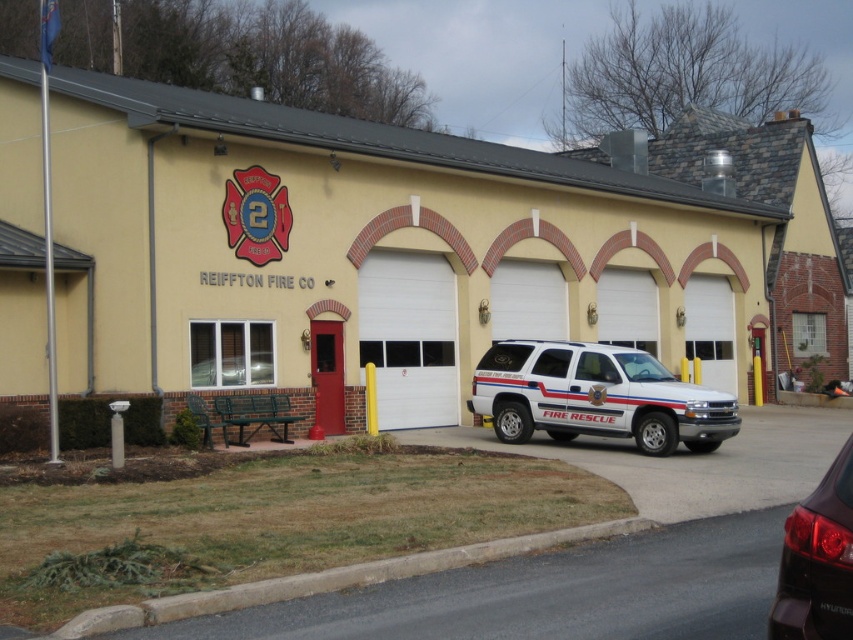
Question: Does white matte fire rescue vehicle at center appear over shiny black suv at lower right?

Choices:
 (A) no
 (B) yes

Answer: (B)

Question: Which point is closer to the camera taking this photo?

Choices:
 (A) (564, 372)
 (B) (844, 518)

Answer: (B)

Question: Which point appears farthest from the camera in this image?

Choices:
 (A) (630, 422)
 (B) (795, 532)

Answer: (A)

Question: Is white matte fire rescue vehicle at center positioned behind shiny black suv at lower right?

Choices:
 (A) yes
 (B) no

Answer: (A)

Question: Is white matte fire rescue vehicle at center below shiny black suv at lower right?

Choices:
 (A) no
 (B) yes

Answer: (A)